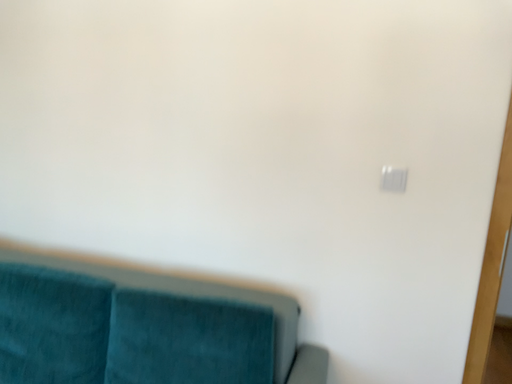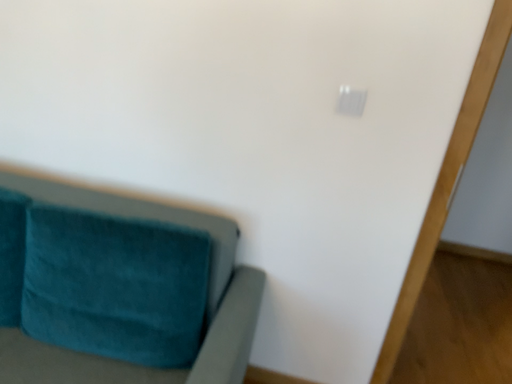
Question: How did the camera likely rotate when shooting the video?

Choices:
 (A) rotated downward
 (B) rotated upward

Answer: (A)